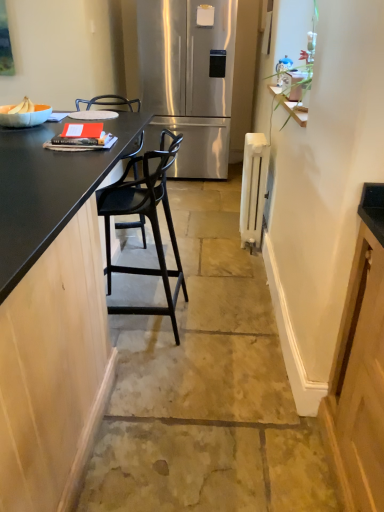
Question: Is matte black barstool at center wider than black matte countertop at left?

Choices:
 (A) no
 (B) yes

Answer: (B)

Question: Can you confirm if matte black barstool at center is shorter than black matte countertop at left?

Choices:
 (A) no
 (B) yes

Answer: (B)

Question: Does matte black barstool at center appear on the right side of black matte countertop at left?

Choices:
 (A) yes
 (B) no

Answer: (A)

Question: From the image's perspective, is matte black barstool at center located above black matte countertop at left?

Choices:
 (A) no
 (B) yes

Answer: (A)

Question: Considering the relative sizes of matte black barstool at center and black matte countertop at left in the image provided, is matte black barstool at center thinner than black matte countertop at left?

Choices:
 (A) no
 (B) yes

Answer: (A)

Question: From a real-world perspective, is matte black barstool at center physically located above or below black matte bar stool at center?

Choices:
 (A) above
 (B) below

Answer: (B)

Question: In the image, is matte black barstool at center positioned in front of or behind black matte bar stool at center?

Choices:
 (A) behind
 (B) front

Answer: (B)

Question: Does point (193, 280) appear closer or farther from the camera than point (175, 259)?

Choices:
 (A) closer
 (B) farther

Answer: (B)

Question: In terms of height, does matte black barstool at center look taller or shorter compared to black matte bar stool at center?

Choices:
 (A) short
 (B) tall

Answer: (A)

Question: From a real-world perspective, is white painted metal radiator at right above or below stainless steel refrigerator at center?

Choices:
 (A) above
 (B) below

Answer: (B)

Question: From the image's perspective, relative to stainless steel refrigerator at center, is white painted metal radiator at right above or below?

Choices:
 (A) below
 (B) above

Answer: (A)

Question: Is white painted metal radiator at right inside the boundaries of stainless steel refrigerator at center, or outside?

Choices:
 (A) inside
 (B) outside

Answer: (B)

Question: Based on their sizes in the image, would you say white painted metal radiator at right is bigger or smaller than stainless steel refrigerator at center?

Choices:
 (A) small
 (B) big

Answer: (A)

Question: Considering the positions of point (266, 152) and point (135, 190), is point (266, 152) closer or farther from the camera than point (135, 190)?

Choices:
 (A) farther
 (B) closer

Answer: (A)

Question: Considering the positions of white painted metal radiator at right and black matte bar stool at center in the image, is white painted metal radiator at right wider or thinner than black matte bar stool at center?

Choices:
 (A) wide
 (B) thin

Answer: (B)